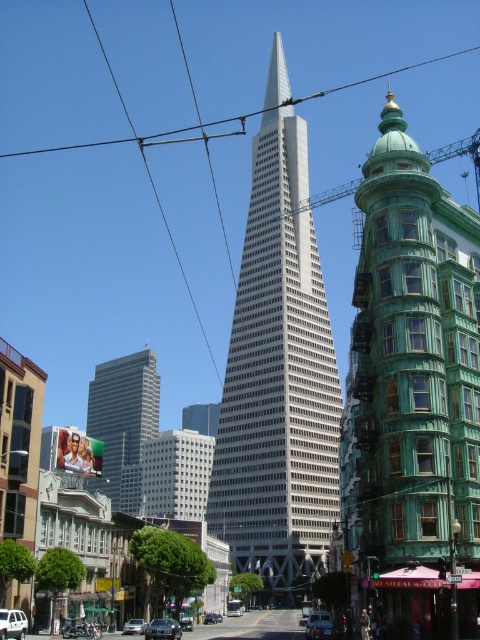
Question: Considering the real-world distances, which object is closest to the silver metallic sedan at center?

Choices:
 (A) metallic wire at upper center
 (B) green glass skyscraper at center

Answer: (B)

Question: Estimate the real-world distances between objects in this image. Which object is closer to the metallic wire at upper center?

Choices:
 (A) metallic silver car at center
 (B) green matte car at center
 (C) white matte suv at center
 (D) green glass skyscraper at center

Answer: (D)

Question: Does silver metallic sedan at center have a greater width compared to green matte car at center?

Choices:
 (A) yes
 (B) no

Answer: (B)

Question: Can you confirm if metallic wire at upper center is positioned to the right of shiny silver sedan at center?

Choices:
 (A) no
 (B) yes

Answer: (B)

Question: Can you confirm if green matte building at center is smaller than green matte car at center?

Choices:
 (A) no
 (B) yes

Answer: (A)

Question: Which point is closer to the camera taking this photo?

Choices:
 (A) (315, 97)
 (B) (192, 620)

Answer: (B)